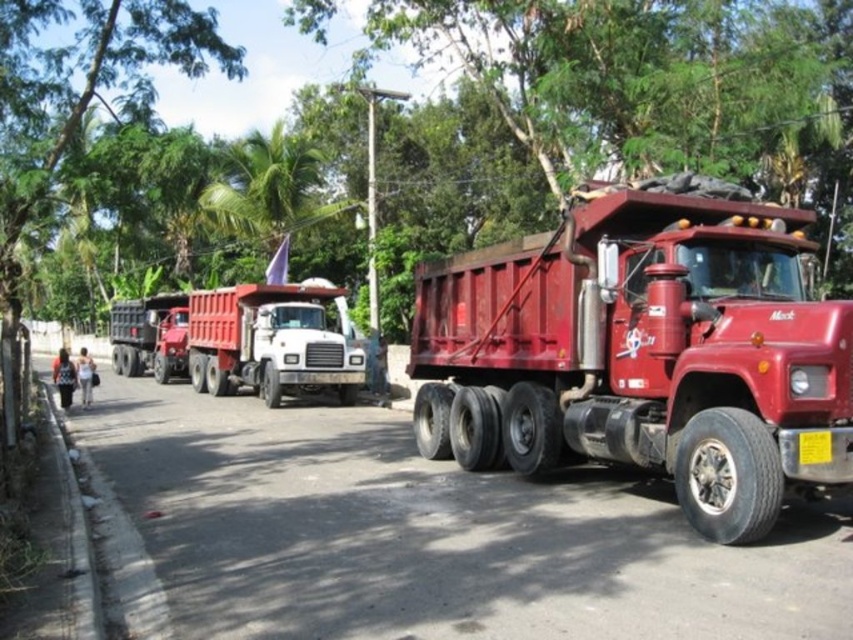
Based on the photo, you are a delivery driver who needs to park your truck between the shiny red trailer truck at center and the matte red dump truck at center. Since you want to ensure there is enough space for your truck which is 2.5 meters wide, can you determine if there is sufficient space between them?

The shiny red trailer truck at center has a lesser width compared to the matte red dump truck at center. The total width between them would be the sum of both widths. However, without knowing their exact widths, it is impossible to determine if there is enough space for a 2.5 meter wide truck. Please check the exact measurements of both trucks before deciding.

You are a pedestrian standing on the sidewalk on the left side of the road. You want to cross the road to reach the shiny red trailer truck at center. Which direction should you walk to get there from the green leafy tree at upper center?

To reach the shiny red trailer truck at center from the green leafy tree at upper center, you should walk to the right since the shiny red trailer truck at center is located to the right of the green leafy tree at upper center.